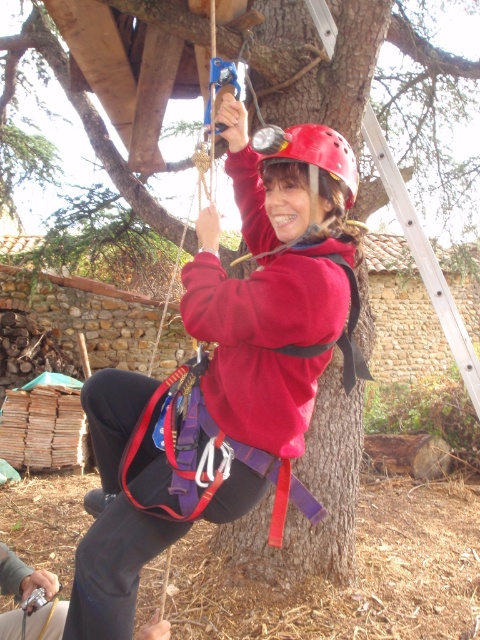
Is matte red jacket at center below red matte helmet at center?

Yes.

Can you confirm if matte red jacket at center is thinner than red matte helmet at center?

No, matte red jacket at center is not thinner than red matte helmet at center.

Is point (141, 400) in front of point (295, 136)?

No.

This screenshot has height=640, width=480. Identify the location of matte red jacket at center. (271, 285).